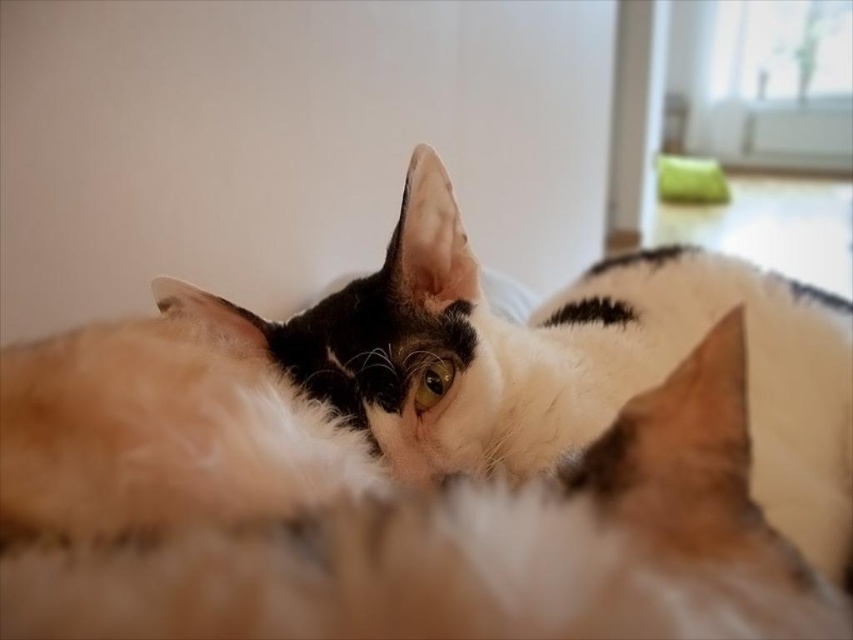
Question: Is fluffy white cat at center above green fabric pillow at upper right?

Choices:
 (A) yes
 (B) no

Answer: (B)

Question: Which object appears farthest from the camera in this image?

Choices:
 (A) fluffy white cat at center
 (B) green fabric pillow at upper right

Answer: (B)

Question: Is fluffy white cat at center to the left of green fabric pillow at upper right from the viewer's perspective?

Choices:
 (A) yes
 (B) no

Answer: (A)

Question: In this image, where is fluffy white cat at center located relative to green fabric pillow at upper right?

Choices:
 (A) right
 (B) left

Answer: (B)